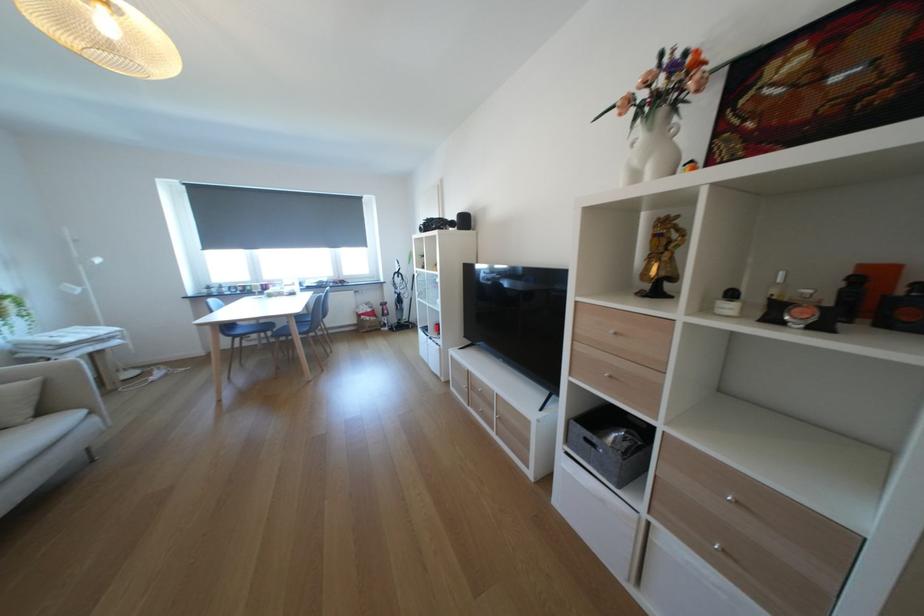
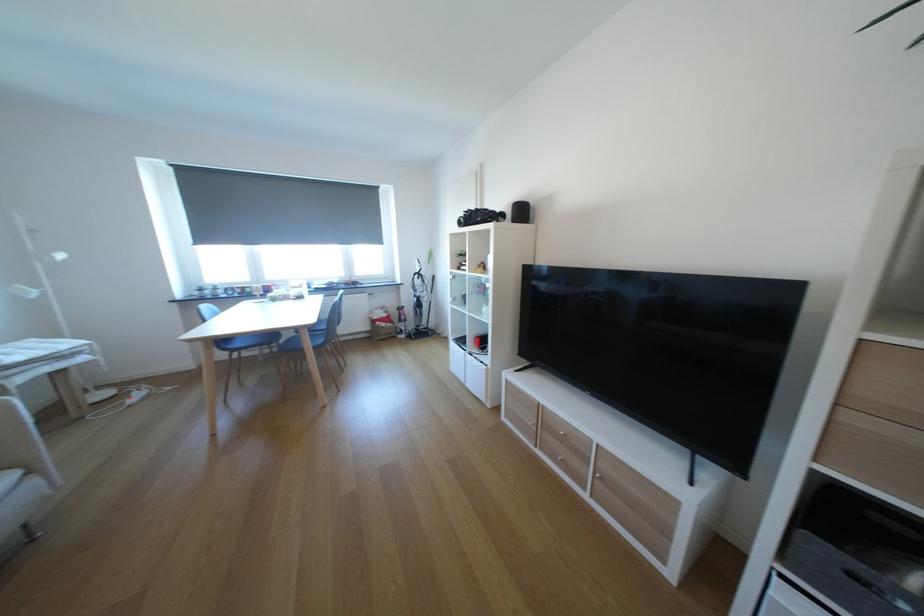
Where in the second image is the point corresponding to pixel 505 411 from the first image?

(600, 467)